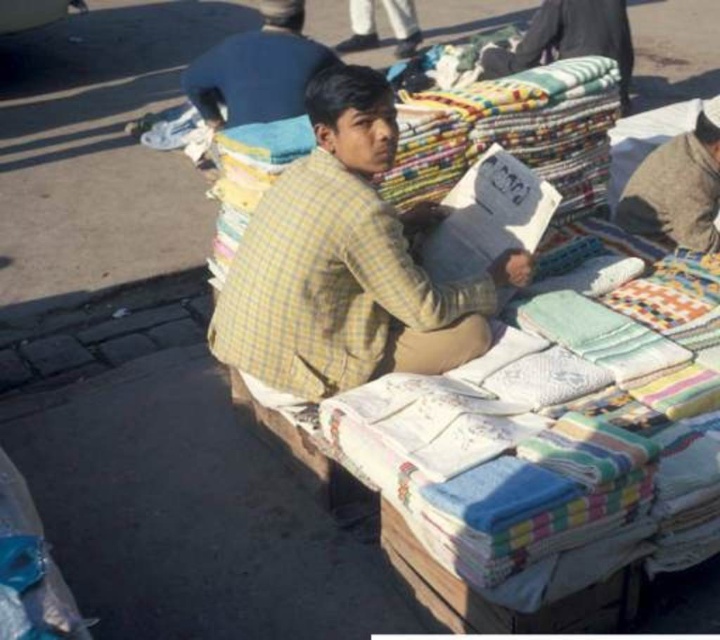
You are a customer looking at the vendor and their textiles. Which item is positioned higher up between the yellow checkered shirt at center and the multicolored fabric at upper right?

The multicolored fabric at upper right is positioned higher up than the yellow checkered shirt at center.

You are a customer standing in front of the vendor. You want to grab the light blue fabric at upper center from the cart. However, you are wearing a light blue shirt at center. Since both items are light blue, how can you tell them apart?

The light blue shirt at center and light blue fabric at upper center are 3.55 meters apart. The shirt is closer to you, while the fabric is farther away on the cart.